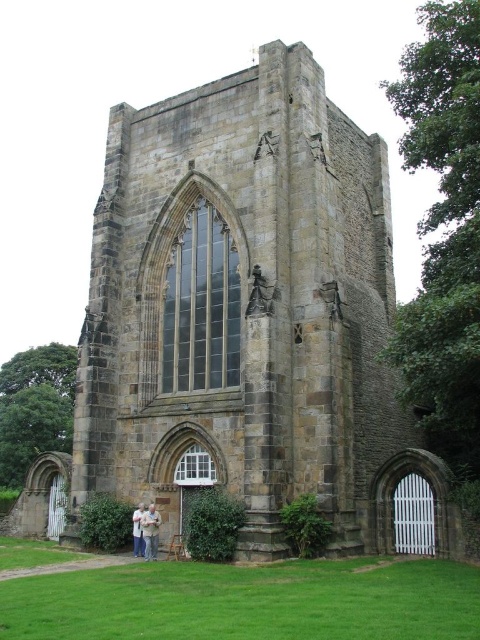
Question: Which of the following is the closest to the observer?

Choices:
 (A) white fabric shirt at lower center
 (B) green grass at lower center

Answer: (B)

Question: Which point appears farthest from the camera in this image?

Choices:
 (A) (156, 528)
 (B) (375, 625)

Answer: (A)

Question: Is the position of green grass at lower center more distant than that of white fabric shirt at lower center?

Choices:
 (A) yes
 (B) no

Answer: (B)

Question: Where is light brown wooden couple at lower center located in relation to white fabric shirt at lower center in the image?

Choices:
 (A) above
 (B) below

Answer: (A)

Question: Which of the following is the closest to the observer?

Choices:
 (A) (140, 541)
 (B) (278, 614)

Answer: (B)

Question: Does green grass at lower center have a greater width compared to light brown wooden couple at lower center?

Choices:
 (A) yes
 (B) no

Answer: (A)